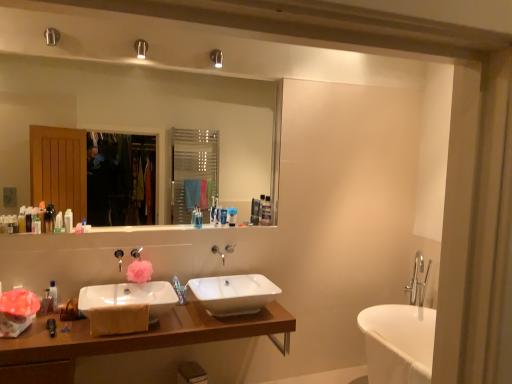
Question: Can white ceramic sink at lower left, the 2th sink positioned from the right, be found inside translucent plastic bottle at left, which is counted as the fifth toiletry, starting from the left?

Choices:
 (A) no
 (B) yes

Answer: (A)

Question: From the image's perspective, is translucent plastic bottle at left, which ranks as the eighth toiletry in right-to-left order, located above white ceramic sink at lower left, positioned as the first sink in left-to-right order?

Choices:
 (A) no
 (B) yes

Answer: (B)

Question: Is translucent plastic bottle at left, which is counted as the fifth toiletry, starting from the left, smaller than white ceramic sink at lower left, the 2th sink positioned from the right?

Choices:
 (A) no
 (B) yes

Answer: (B)

Question: Is translucent plastic bottle at left, which is counted as the fifth toiletry, starting from the left, far away from white ceramic sink at lower left, the 2th sink positioned from the right?

Choices:
 (A) yes
 (B) no

Answer: (B)

Question: Does translucent plastic bottle at left, which is counted as the fifth toiletry, starting from the left, have a lesser height compared to white ceramic sink at lower left, positioned as the first sink in left-to-right order?

Choices:
 (A) yes
 (B) no

Answer: (B)

Question: Is translucent plastic bottle at left, which is the 10th toiletry from right to left, taller or shorter than blue matte toothpaste tube at center, which appears as the ninth toiletry when viewed from the left?

Choices:
 (A) short
 (B) tall

Answer: (B)

Question: Do you think translucent plastic bottle at left, which is the 10th toiletry from right to left, is within blue matte toothpaste tube at center, placed as the 4th toiletry when sorted from right to left, or outside of it?

Choices:
 (A) inside
 (B) outside

Answer: (B)

Question: Considering the relative positions of translucent plastic bottle at left, marked as the 3th toiletry in a left-to-right arrangement, and blue matte toothpaste tube at center, which appears as the ninth toiletry when viewed from the left, in the image provided, is translucent plastic bottle at left, marked as the 3th toiletry in a left-to-right arrangement, to the left or to the right of blue matte toothpaste tube at center, which appears as the ninth toiletry when viewed from the left,?

Choices:
 (A) left
 (B) right

Answer: (A)

Question: Is point (35, 218) positioned closer to the camera than point (221, 215)?

Choices:
 (A) farther
 (B) closer

Answer: (B)

Question: Considering the positions of white glossy mirror at upper center and translucent plastic bottles at left, which is the 9th toiletry in right-to-left order, in the image, is white glossy mirror at upper center taller or shorter than translucent plastic bottles at left, which is the 9th toiletry in right-to-left order,?

Choices:
 (A) short
 (B) tall

Answer: (B)

Question: From a real-world perspective, is white glossy mirror at upper center positioned above or below translucent plastic bottles at left, placed as the 4th toiletry when sorted from left to right?

Choices:
 (A) below
 (B) above

Answer: (B)

Question: Looking at their shapes, would you say white glossy mirror at upper center is wider or thinner than translucent plastic bottles at left, which is the 9th toiletry in right-to-left order?

Choices:
 (A) wide
 (B) thin

Answer: (A)

Question: Does point (252, 86) appear closer or farther from the camera than point (41, 200)?

Choices:
 (A) closer
 (B) farther

Answer: (A)

Question: Considering the positions of point (55, 286) and point (256, 223), is point (55, 286) closer or farther from the camera than point (256, 223)?

Choices:
 (A) farther
 (B) closer

Answer: (B)

Question: Considering the positions of translucent plastic bottle at lower left, the sixth toiletry from the left, and clear plastic bottle at upper center, which ranks as the second toiletry in right-to-left order, in the image, is translucent plastic bottle at lower left, the sixth toiletry from the left, bigger or smaller than clear plastic bottle at upper center, which ranks as the second toiletry in right-to-left order,?

Choices:
 (A) small
 (B) big

Answer: (A)